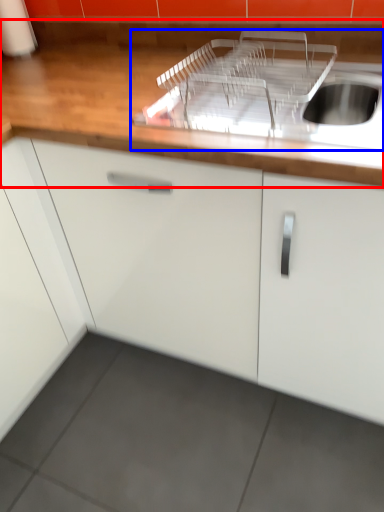
Question: Which point is closer to the camera, countertop (highlighted by a red box) or sink (highlighted by a blue box)?

Choices:
 (A) countertop
 (B) sink

Answer: (A)